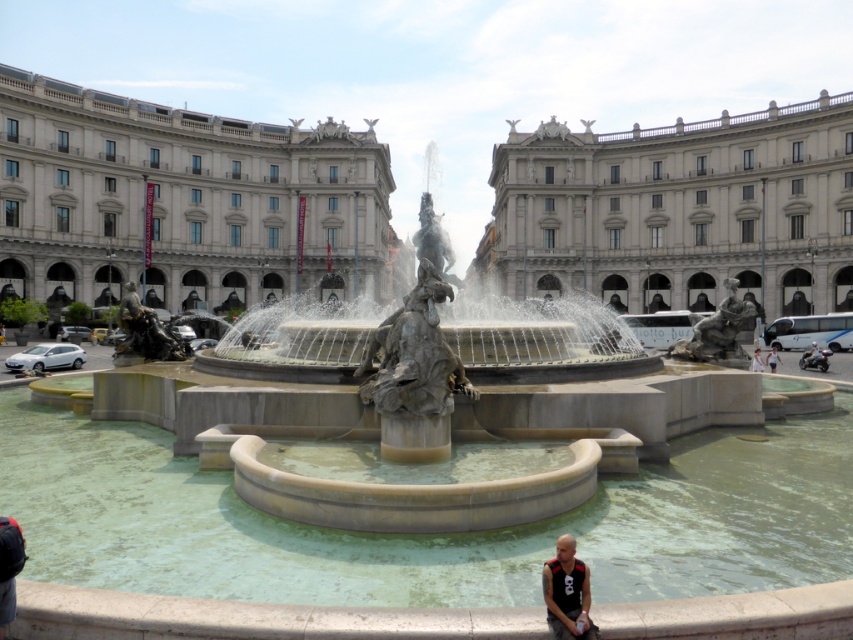
You are an architect visiting the public square and notice the white marble palace at center and the matte black tank top at lower right. Which object is wider?

The white marble palace at center is wider than the matte black tank top at lower right according to the description provided.

You are a tourist standing in the public square and want to take a photo of the white marble palace at center and the matte black tank top at lower right. Which object should you focus on first if you want to capture both in a single frame without moving your camera?

The white marble palace at center is taller than the matte black tank top at lower right, so you should focus on the white marble palace at center first to ensure it fits within the frame.

You are an artist planning to sketch the scene of the grand fountain. You notice the white marble palace at center and the matte black tank top at lower right. Which object should you draw first if you want to capture the most prominent feature of the scene?

The white marble palace at center should be drawn first because it has a larger size compared to the matte black tank top at lower right, making it the most prominent feature in the scene.